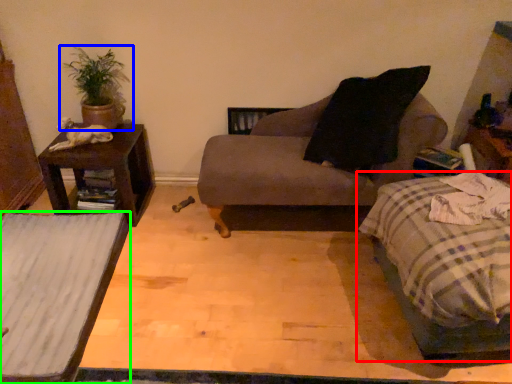
Question: Which is nearer to the bed (highlighted by a red box)? houseplant (highlighted by a blue box) or table (highlighted by a green box).

Choices:
 (A) houseplant
 (B) table

Answer: (B)